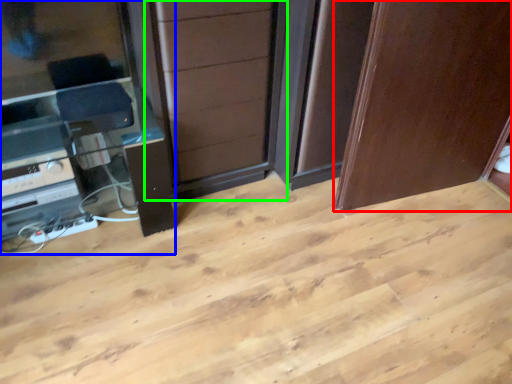
Question: Considering the real-world distances, which object is farthest from door (highlighted by a red box)? entertainment center (highlighted by a blue box) or screen door (highlighted by a green box)?

Choices:
 (A) entertainment center
 (B) screen door

Answer: (A)